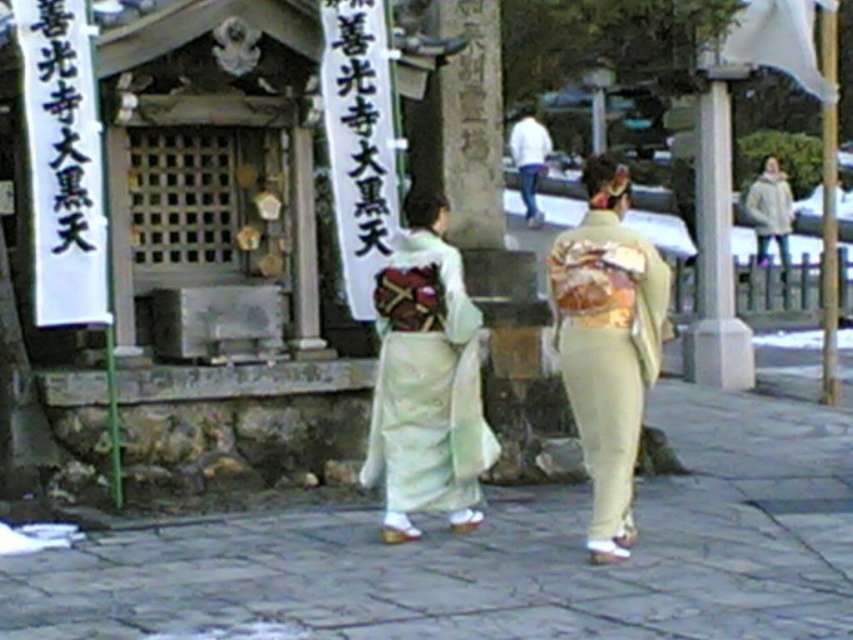
You are standing at the entrance of the temple and want to walk towards the two points marked in the image. Which point, point (645, 276) or point (761, 230), will you reach first?

Point (645, 276) is closer to the viewer than point (761, 230), so you will reach point (645, 276) first.

You are a photographer trying to capture both the light beige kimono at center and the white cotton jacket at upper right in a single shot. Based on their positions, which one would appear closer to the camera in the photo?

The light beige kimono at center appears closer to the camera because it is positioned in front of the white cotton jacket at upper right.